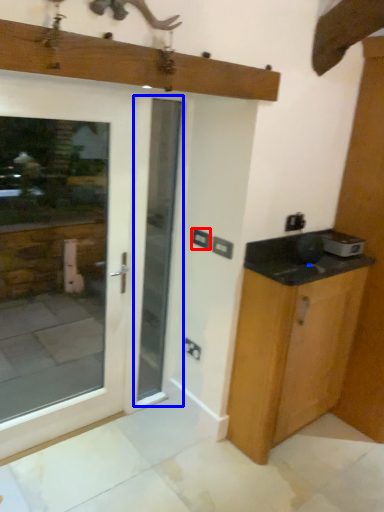
Question: Among these objects, which one is nearest to the camera, electric outlet (highlighted by a red box) or screen door (highlighted by a blue box)?

Choices:
 (A) electric outlet
 (B) screen door

Answer: (B)